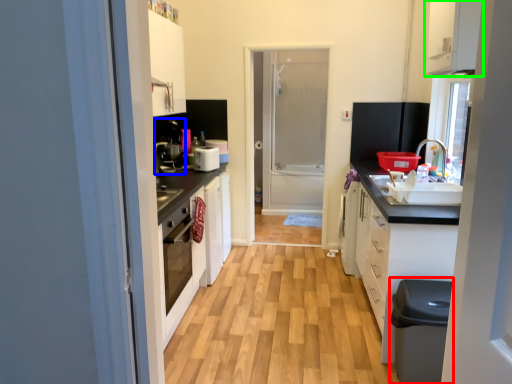
Question: Which is farther away from dish washer (highlighted by a red box)? coffee machine (highlighted by a blue box) or cabinetry (highlighted by a green box)?

Choices:
 (A) coffee machine
 (B) cabinetry

Answer: (A)